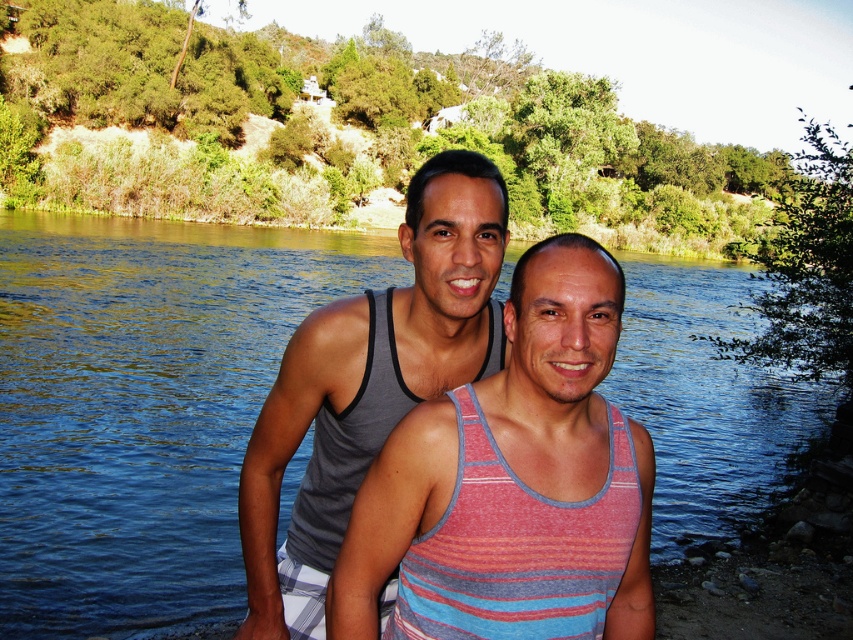
Question: Is striped cotton tank top at center bigger than gray heather tank top at center?

Choices:
 (A) yes
 (B) no

Answer: (B)

Question: Can you confirm if blue water at center is positioned to the right of striped cotton tank top at center?

Choices:
 (A) no
 (B) yes

Answer: (B)

Question: Among these objects, which one is farthest from the camera?

Choices:
 (A) blue water at center
 (B) gray heather tank top at center

Answer: (A)

Question: Which object is farther from the camera taking this photo?

Choices:
 (A) gray heather tank top at center
 (B) blue water at center
 (C) striped cotton tank top at center

Answer: (B)

Question: Which object is the farthest from the blue water at center?

Choices:
 (A) striped cotton tank top at center
 (B) gray heather tank top at center

Answer: (B)

Question: Is striped cotton tank top at center smaller than gray heather tank top at center?

Choices:
 (A) yes
 (B) no

Answer: (A)